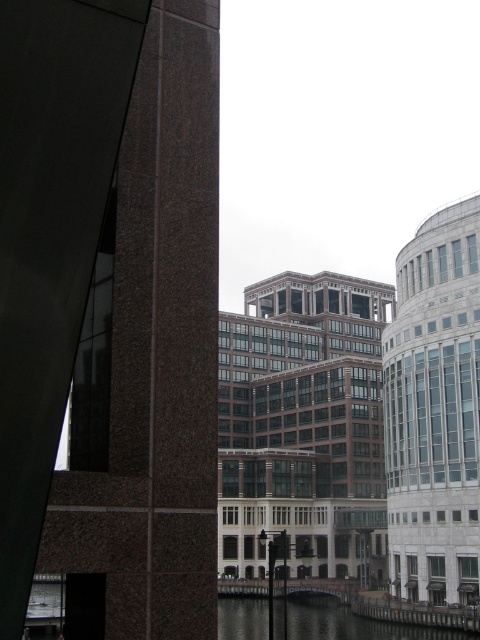
Does brown glass building at center appear over white glass tower at right?

Yes, brown glass building at center is above white glass tower at right.

Describe the element at coordinates (303, 426) in the screenshot. I see `brown glass building at center` at that location.

This screenshot has width=480, height=640. What are the coordinates of `brown glass building at center` in the screenshot? It's located at (303, 426).

Does brown stone tower at left have a larger size compared to white glass tower at right?

No.

Is point (200, 244) in front of point (450, 218)?

Yes, it is.

Between point (118, 426) and point (391, 540), which one is positioned behind?

The point (391, 540) is more distant.

At what (x,y) coordinates should I click in order to perform the action: click on brown stone tower at left. Please return your answer as a coordinate pair (x, y). Looking at the image, I should click on (149, 362).

In the scene shown: Is brown stone tower at left further to the viewer compared to brown glass building at center?

No, it is not.

Can you confirm if brown stone tower at left is positioned to the right of brown glass building at center?

No, brown stone tower at left is not to the right of brown glass building at center.

You are a GUI agent. You are given a task and a screenshot of the screen. Output one action in this format:
    pyautogui.click(x=<x>, y=<y>)
    Task: Click on the brown stone tower at left
    Image resolution: width=480 pixels, height=640 pixels.
    Given the screenshot: What is the action you would take?
    pyautogui.click(x=149, y=362)